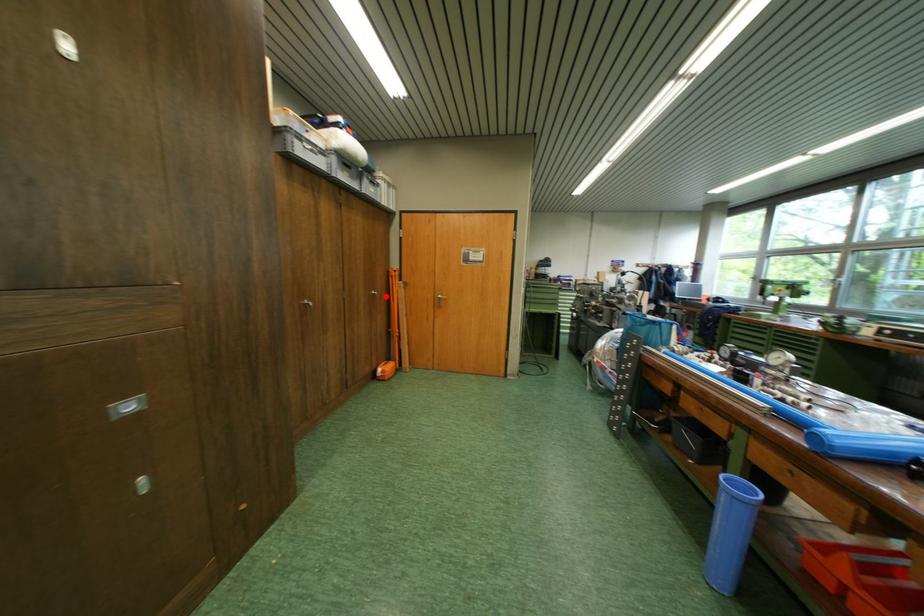
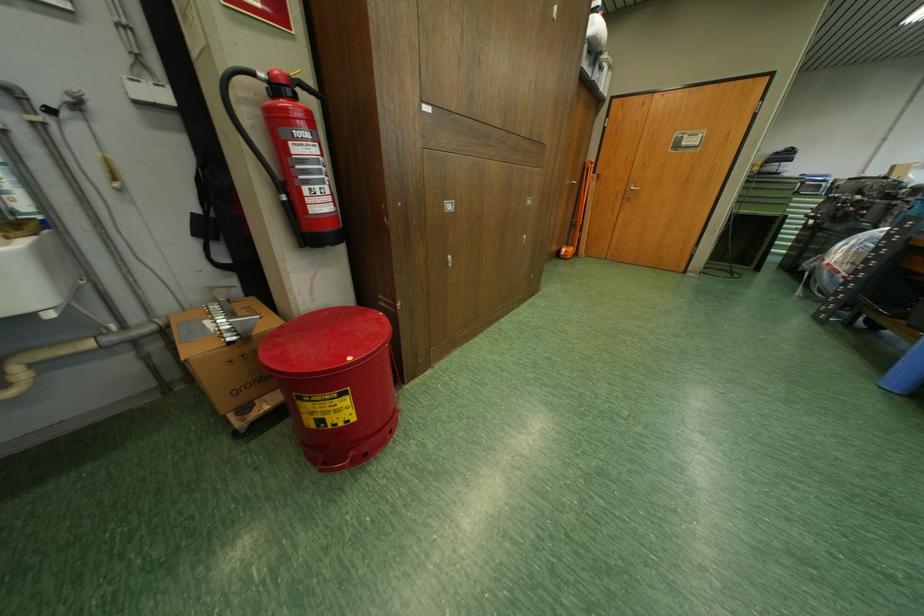
Where in the second image is the point corresponding to the highlighted location from the first image?

(585, 185)